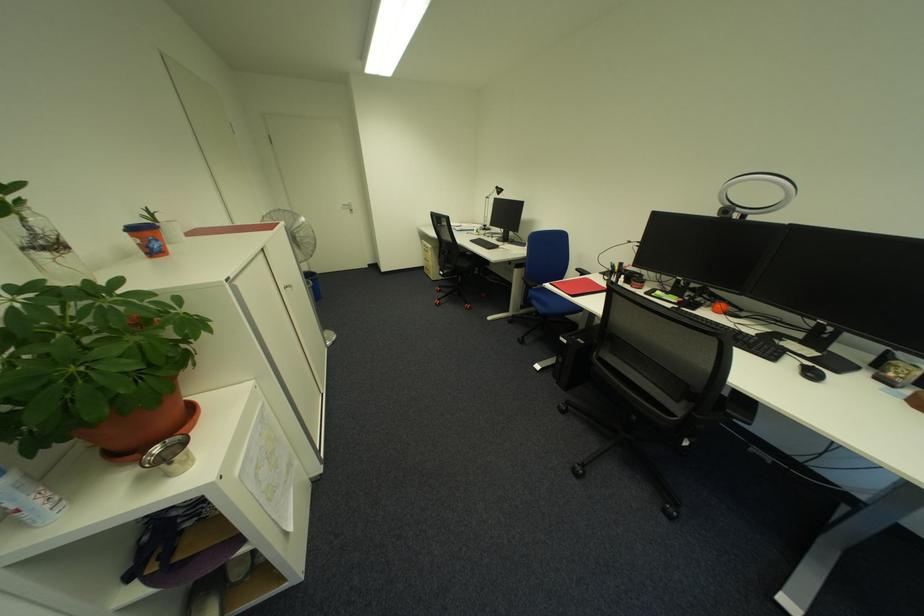
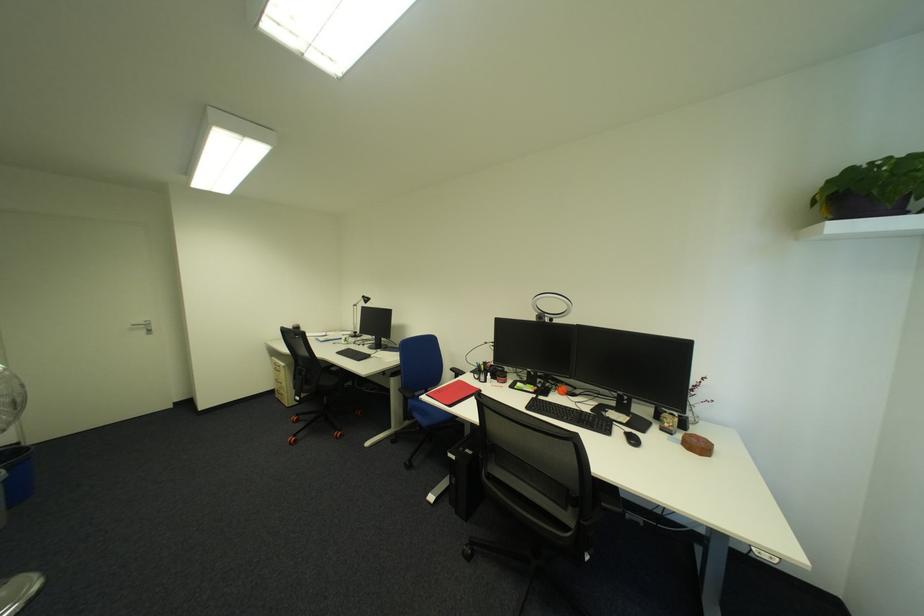
Find the pixel in the second image that matches point (723, 213) in the first image.

(542, 318)